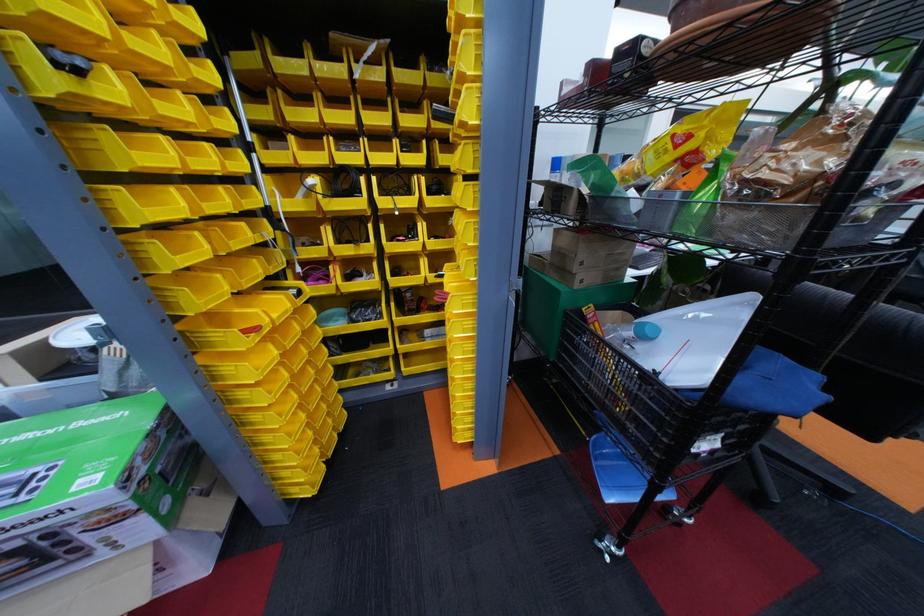
Locate an element on the screen. white plastic tray is located at coordinates (686, 339).